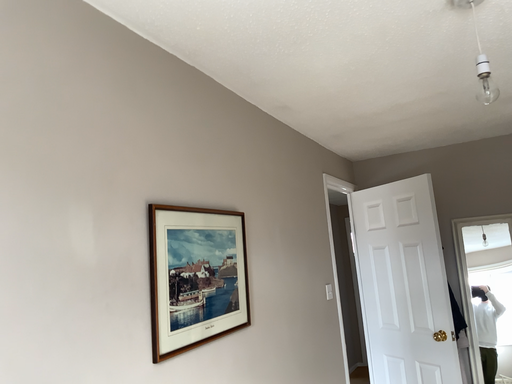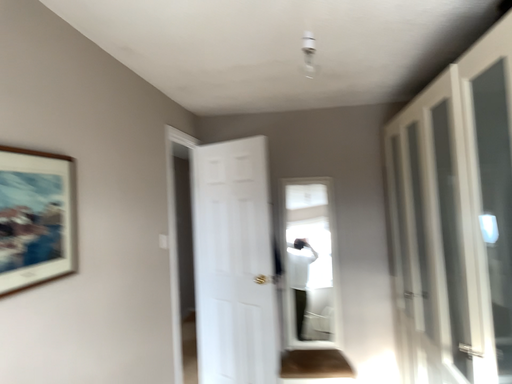
Question: Which way did the camera rotate in the video?

Choices:
 (A) rotated downward
 (B) rotated upward

Answer: (A)